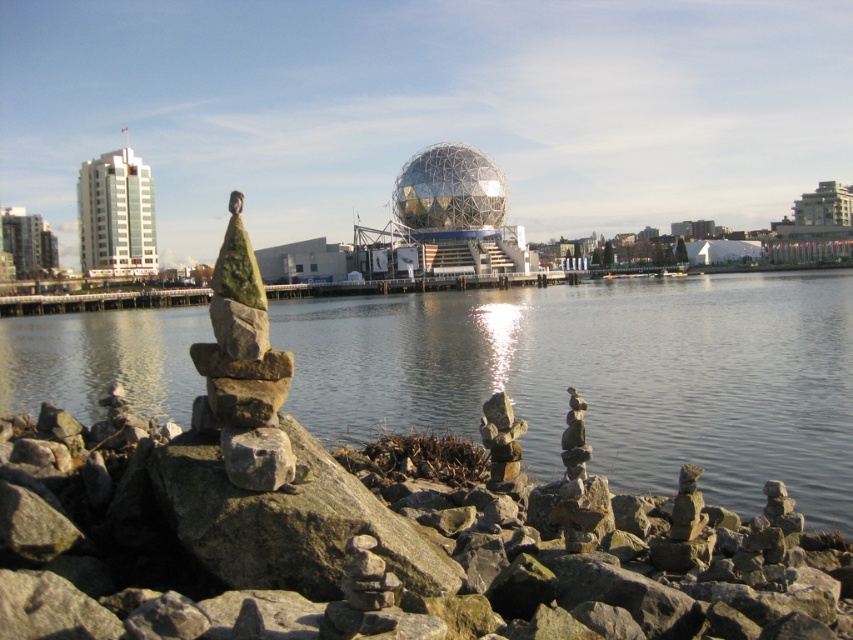
You are standing at the edge of the rocky shoreline and want to place a small marker exactly at the center of the water surface. According to the image, where should you place it relative to the smooth gray rock at center?

The smooth gray rock at center is located at point (370,545), so you should place the marker at the center of the water surface which is the midpoint between the shoreline and the horizon line, but since the rock is near the center of the image, the marker should be placed slightly to the right and above the smooth gray rock at center to reach the water surface center.

You are a sculptor who needs to transport both the smooth gray rock at center and the shiny metallic sphere at center using a flatbed truck with a maximum width capacity of 1 meter. Based on the scene, can both objects fit side by side on the truck bed without exceeding the width limit?

The smooth gray rock at center is thinner than the shiny metallic sphere at center. Since the truck bed can hold up to 1 meter in width, and the combined width of both objects would depend on their individual dimensions. However, since the rock is thinner, it is possible that together they might fit within the limit if their total width does not exceed 1 meter. Without exact measurements, we can only assume based on the description that the sphere is wider, so if the sphere alone is under 1 meter, they may.